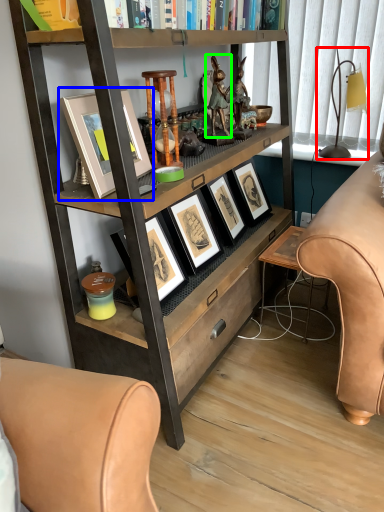
Question: Which object is positioned farthest from table lamp (highlighted by a red box)? Select from picture frame (highlighted by a blue box) and animal (highlighted by a green box).

Choices:
 (A) picture frame
 (B) animal

Answer: (A)